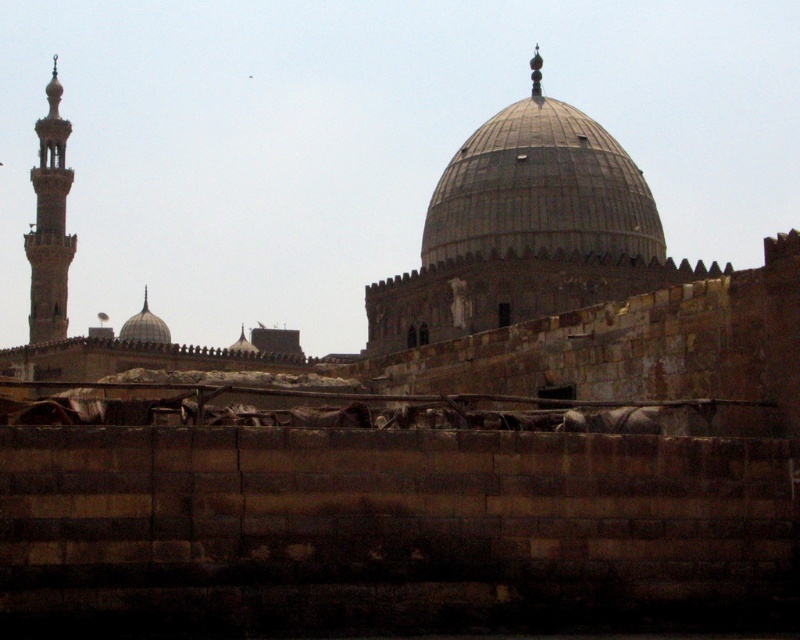
Question: Estimate the real-world distances between objects in this image. Which object is farther from the gray stone dome at center?

Choices:
 (A) smooth stone minaret at left
 (B) matte gray dome at center

Answer: (A)

Question: Is gray stone dome at center below smooth stone minaret at left?

Choices:
 (A) yes
 (B) no

Answer: (A)

Question: Among these objects, which one is nearest to the camera?

Choices:
 (A) gray stone dome at center
 (B) smooth stone minaret at left

Answer: (A)

Question: Which object is closer to the camera taking this photo?

Choices:
 (A) gray stone dome at center
 (B) matte gray dome at center

Answer: (A)

Question: From the image, what is the correct spatial relationship of gray stone dome at center in relation to smooth stone minaret at left?

Choices:
 (A) left
 (B) right

Answer: (B)

Question: Does smooth stone minaret at left appear over matte gray dome at center?

Choices:
 (A) yes
 (B) no

Answer: (A)